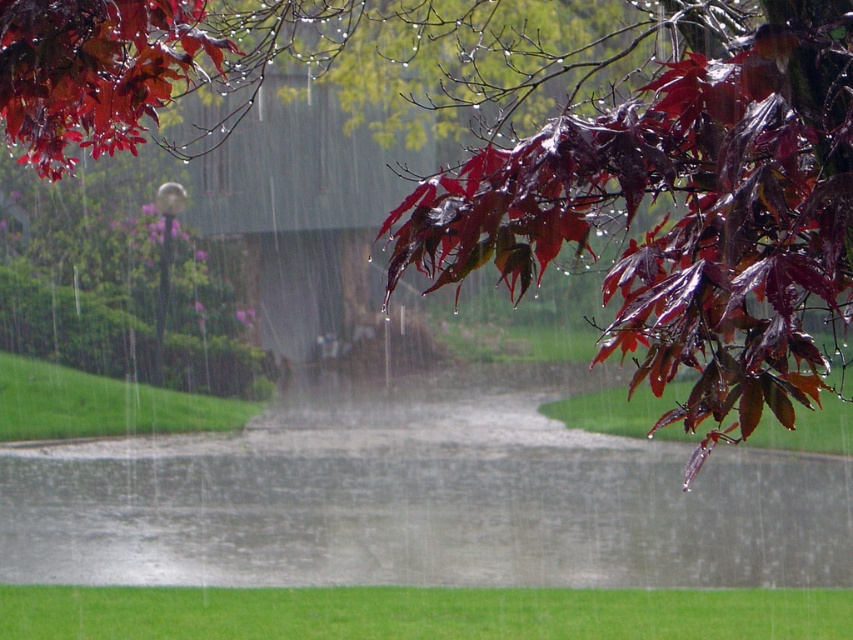
Consider the image. You are standing at the center of the pathway and want to take a photo of the glossy dark red maple leaves at upper right. Which direction should you face to capture them in your shot?

A: The glossy dark red maple leaves at upper right are located at point 0.322 on the x axis and 0.803 on the y axis. Since you are at the center, facing the upper right direction would align your camera with their position.